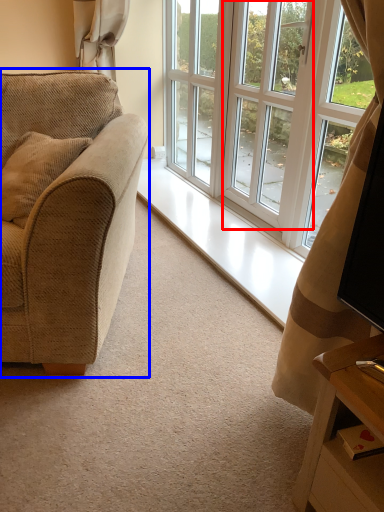
Question: Among these objects, which one is nearest to the camera, screen door (highlighted by a red box) or studio couch (highlighted by a blue box)?

Choices:
 (A) screen door
 (B) studio couch

Answer: (B)